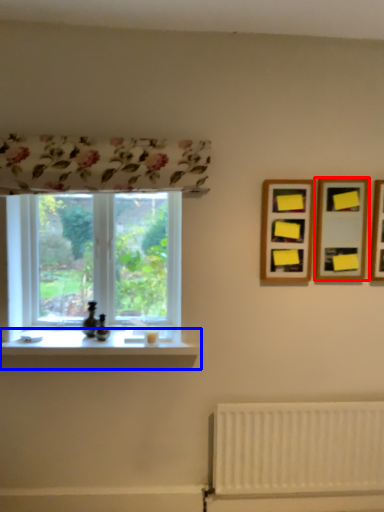
Question: Which of the following is the farthest to the observer, picture frame (highlighted by a red box) or window sill (highlighted by a blue box)?

Choices:
 (A) picture frame
 (B) window sill

Answer: (A)